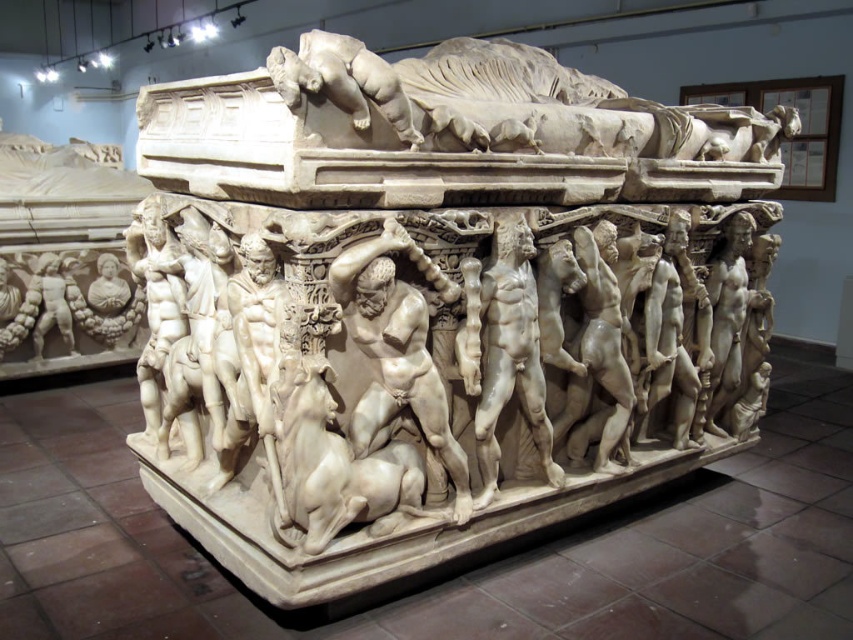
Can you confirm if white marble sarcophagus at center is shorter than white marble/stone bull at center?

In fact, white marble sarcophagus at center may be taller than white marble/stone bull at center.

Who is positioned more to the right, white marble sarcophagus at center or white marble/stone bull at center?

white marble sarcophagus at center

Describe the element at coordinates (440, 294) in the screenshot. I see `white marble sarcophagus at center` at that location.

Where is `white marble sarcophagus at center`? The height and width of the screenshot is (640, 853). white marble sarcophagus at center is located at coordinates (440, 294).

Describe the element at coordinates (506, 104) in the screenshot. This screenshot has width=853, height=640. I see `white marble sarcophagus at upper center` at that location.

Is the position of white marble sarcophagus at upper center less distant than that of smooth white figure at lower left?

Yes, it is.

Locate an element on the screen. Image resolution: width=853 pixels, height=640 pixels. white marble sarcophagus at upper center is located at coordinates (506, 104).

Who is taller, white marble muscular man at center or white marble/stone bull at center?

white marble muscular man at center

Does white marble muscular man at center have a lesser width compared to white marble/stone bull at center?

Indeed, white marble muscular man at center has a lesser width compared to white marble/stone bull at center.

Who is more distant from viewer, (416,256) or (363,490)?

The point (416,256) is more distant.

Find the location of a particular element. The height and width of the screenshot is (640, 853). white marble muscular man at center is located at coordinates pyautogui.click(x=399, y=355).